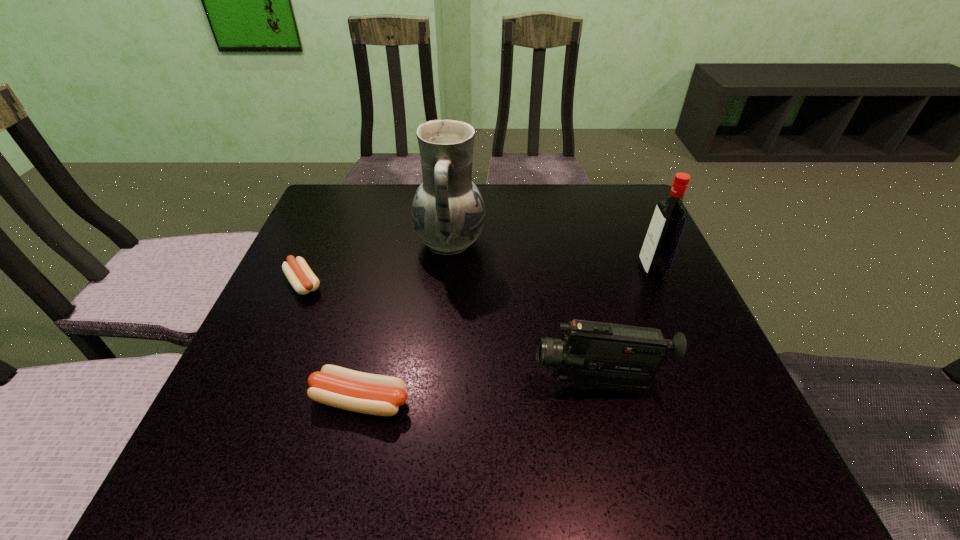
Locate an element on the screen. The image size is (960, 540). pitcher is located at coordinates (448, 213).

The width and height of the screenshot is (960, 540). In order to click on vodka in this screenshot , I will do `click(663, 236)`.

Locate an element on the screen. This screenshot has width=960, height=540. the rightmost object is located at coordinates (663, 236).

You are a GUI agent. You are given a task and a screenshot of the screen. Output one action in this format:
    pyautogui.click(x=<x>, y=<y>)
    Task: Click on the third shortest object
    The height and width of the screenshot is (540, 960).
    Given the screenshot: What is the action you would take?
    pyautogui.click(x=600, y=355)

Where is `camcorder`? Image resolution: width=960 pixels, height=540 pixels. camcorder is located at coordinates (600, 355).

This screenshot has height=540, width=960. I want to click on the taller sausage, so click(336, 386).

Image resolution: width=960 pixels, height=540 pixels. I want to click on the nearer sausage, so click(x=336, y=386).

Locate an element on the screen. This screenshot has width=960, height=540. the left sausage is located at coordinates [x=301, y=277].

Find the location of a particular element. The width and height of the screenshot is (960, 540). the farther sausage is located at coordinates (301, 277).

Find the location of `free space located 0.250m on the front-facing side of the tallest object`. free space located 0.250m on the front-facing side of the tallest object is located at coordinates (588, 243).